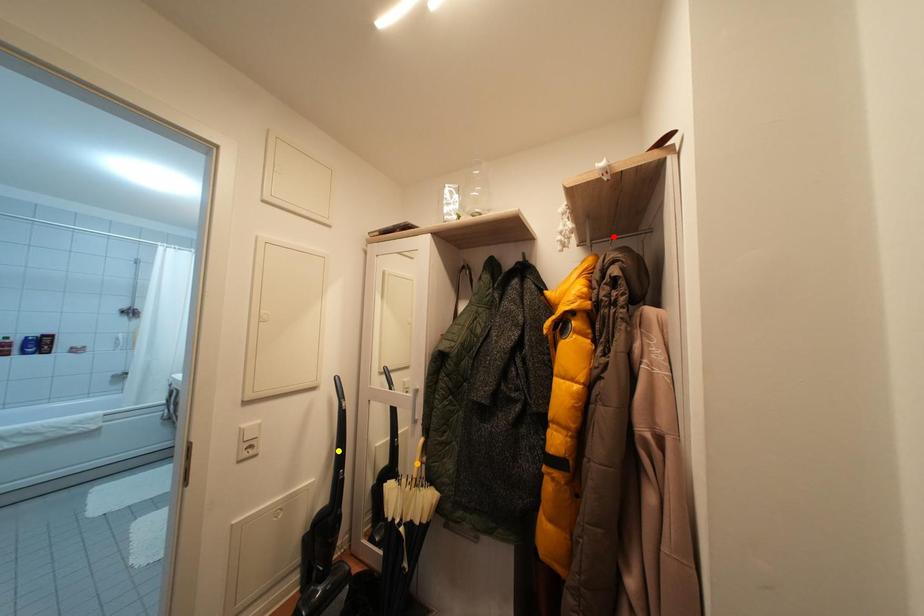
Order these from nearest to farthest:
yellow point
orange point
red point

yellow point
orange point
red point